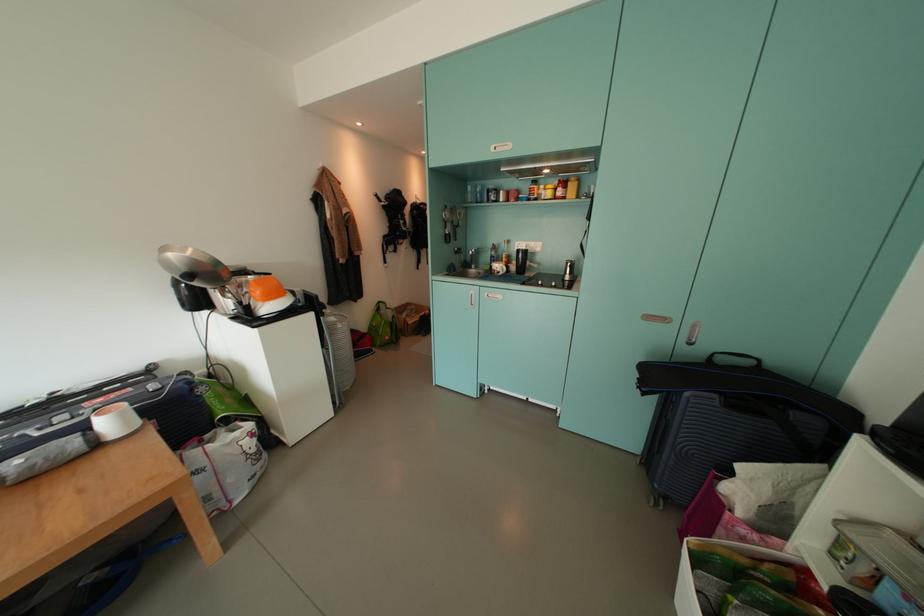
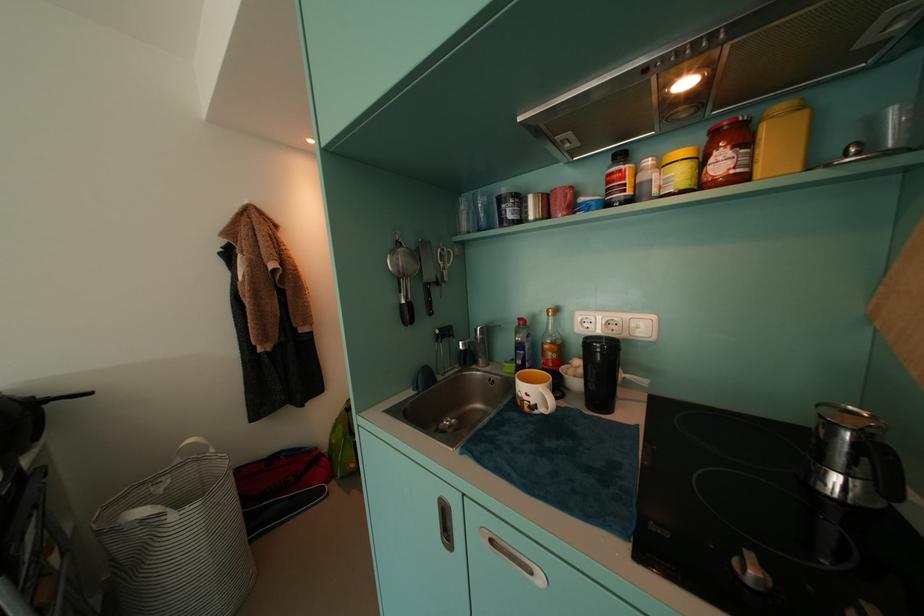
Question: What movement of the cameraman would produce the second image?

Choices:
 (A) Left
 (B) Right
 (C) Forward
 (D) Backward

Answer: (C)